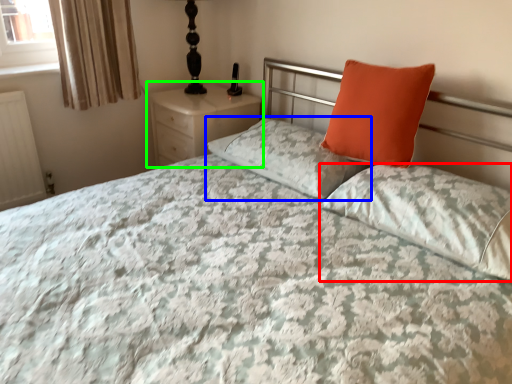
Question: Based on their relative distances, which object is nearer to pillow (highlighted by a red box)? Choose from pillow (highlighted by a blue box) and nightstand (highlighted by a green box).

Choices:
 (A) pillow
 (B) nightstand

Answer: (A)